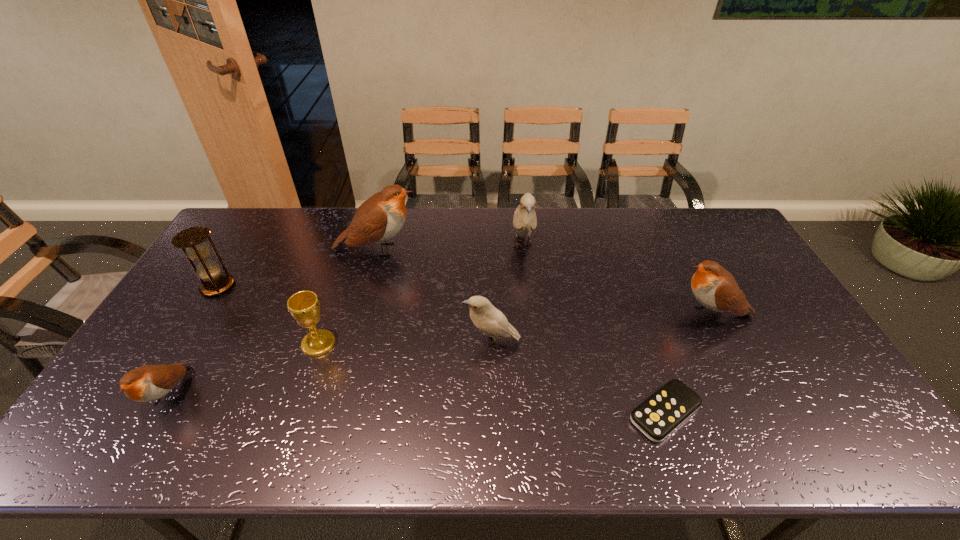
Locate an element on the screen. The image size is (960, 540). the leftmost bird is located at coordinates (147, 383).

Identify the location of the shortest object. (658, 416).

Identify the location of the second object from right to left. [x=658, y=416].

Image resolution: width=960 pixels, height=540 pixels. I want to click on vacant area located 0.070m at the face of the farthest brown bird, so click(440, 250).

Where is `free location located at the beak of the bigger white bird`? free location located at the beak of the bigger white bird is located at coordinates (528, 295).

The image size is (960, 540). I want to click on vacant space located on the right of the hourglass, so click(x=272, y=286).

Identify the location of blank area located 0.050m at the face of the second farthest brown bird. (656, 314).

Find the location of a particular element. The height and width of the screenshot is (540, 960). vacant point located 0.160m at the face of the second farthest brown bird is located at coordinates (618, 314).

Where is `free location located at the face of the second farthest brown bird`? The image size is (960, 540). free location located at the face of the second farthest brown bird is located at coordinates (625, 314).

Locate an element on the screen. free space located at the beak of the nearer white bird is located at coordinates (398, 342).